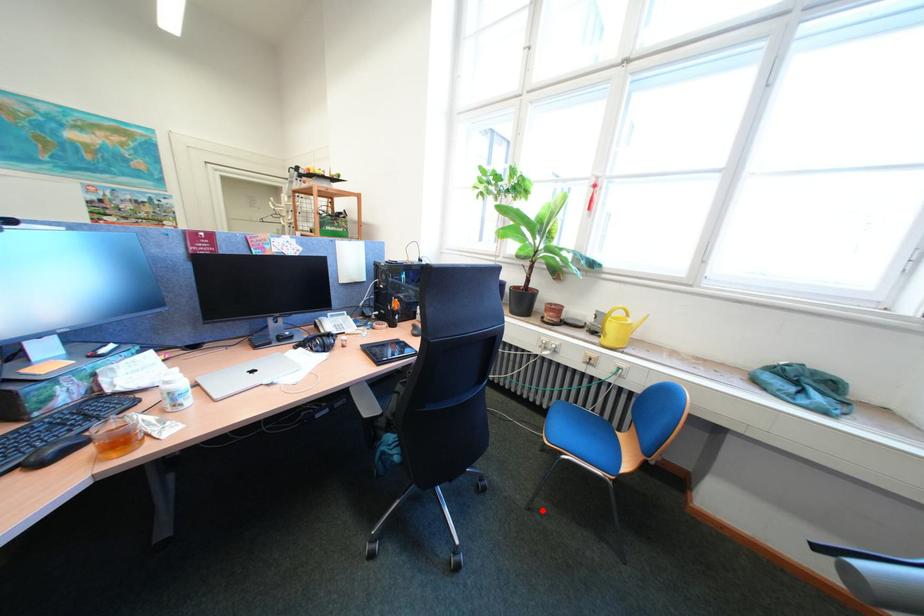
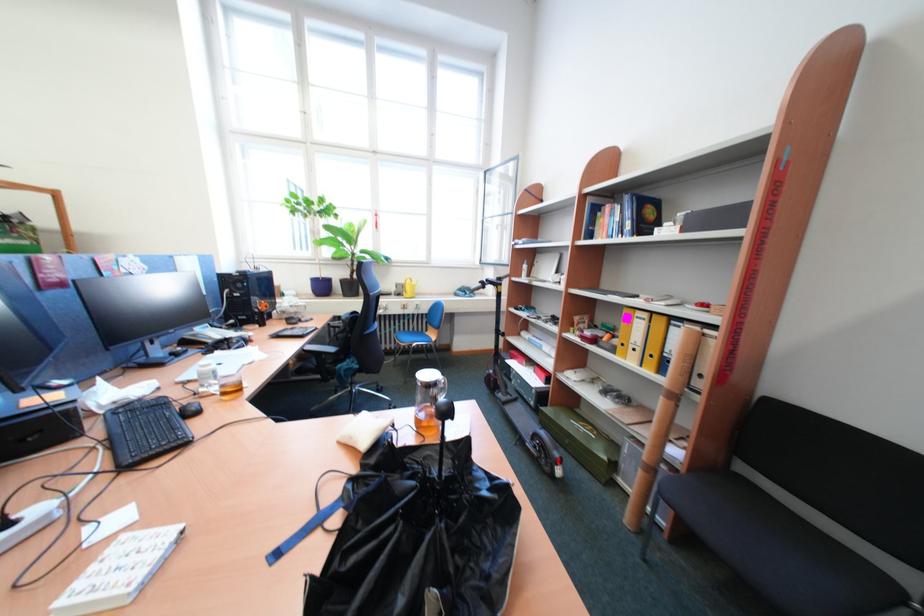
Question: A red point is marked in image1. In image2, is the corresponding 3D point closer to the camera or farther? Reply with the corresponding letter.

Choices:
 (A) The corresponding 3D point is closer.
 (B) The corresponding 3D point is farther.

Answer: (B)